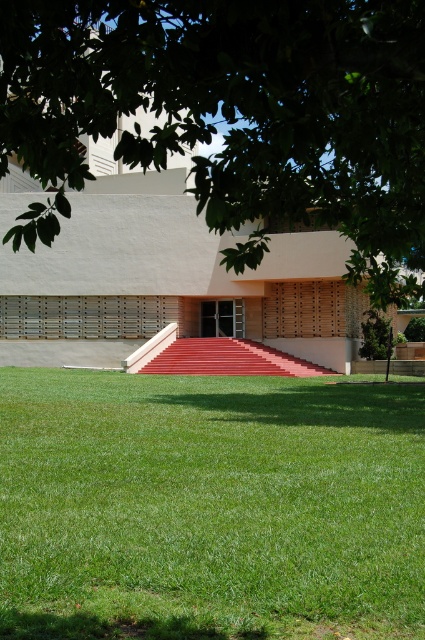
You are a visitor approaching the building and want to reach the entrance. Which object should you look for first as you walk towards the building? The green leafy tree at upper center or the red carpeted stairs at center?

You should look for the red carpeted stairs at center first because the green leafy tree at upper center is to the left of the red carpeted stairs at center, meaning the stairs are closer to the entrance.